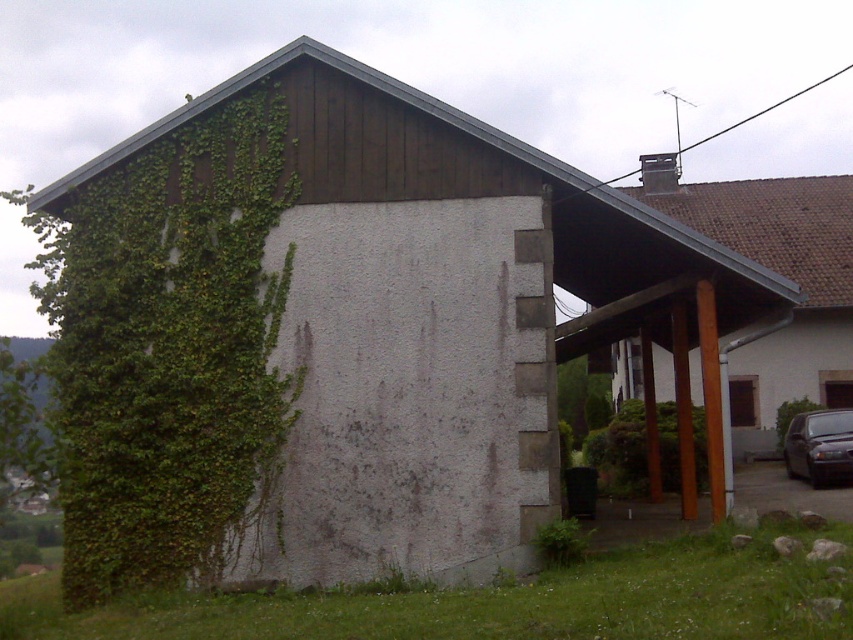
Question: Which object is closer to the camera taking this photo?

Choices:
 (A) metallic gray sedan at lower right
 (B) green ivy at upper left

Answer: (B)

Question: Which point is farther to the camera?

Choices:
 (A) metallic gray sedan at lower right
 (B) brown wood carport at upper right

Answer: (A)

Question: Where is green ivy at upper left located in relation to brown wood carport at upper right in the image?

Choices:
 (A) below
 (B) above

Answer: (A)

Question: Does green ivy at upper left appear on the right side of brown wood carport at upper right?

Choices:
 (A) yes
 (B) no

Answer: (B)

Question: Does green ivy at upper left appear under metallic gray sedan at lower right?

Choices:
 (A) yes
 (B) no

Answer: (B)

Question: Considering the real-world distances, which object is farthest from the brown wood carport at upper right?

Choices:
 (A) green ivy at upper left
 (B) metallic gray sedan at lower right

Answer: (A)